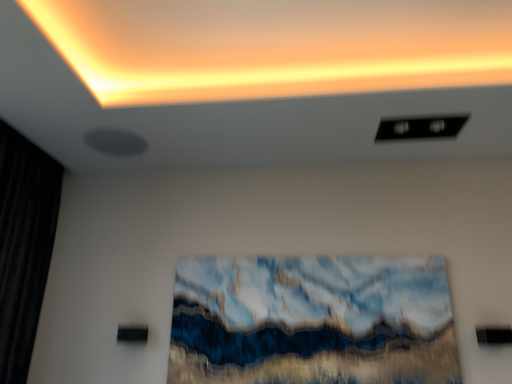
Question: Can you confirm if matte orange glow at upper center is shorter than black fabric curtain at left?

Choices:
 (A) yes
 (B) no

Answer: (A)

Question: From the image's perspective, is matte orange glow at upper center on top of black fabric curtain at left?

Choices:
 (A) no
 (B) yes

Answer: (B)

Question: From the image's perspective, is matte orange glow at upper center below black fabric curtain at left?

Choices:
 (A) no
 (B) yes

Answer: (A)

Question: Is matte orange glow at upper center further to camera compared to black fabric curtain at left?

Choices:
 (A) no
 (B) yes

Answer: (A)

Question: Is matte orange glow at upper center positioned in front of black fabric curtain at left?

Choices:
 (A) yes
 (B) no

Answer: (A)

Question: Does matte orange glow at upper center have a lesser width compared to black fabric curtain at left?

Choices:
 (A) no
 (B) yes

Answer: (A)

Question: Does textured blue and white abstract painting at center have a greater height compared to black fabric curtain at left?

Choices:
 (A) yes
 (B) no

Answer: (B)

Question: Is textured blue and white abstract painting at center wider than black fabric curtain at left?

Choices:
 (A) no
 (B) yes

Answer: (A)

Question: Is textured blue and white abstract painting at center oriented away from black fabric curtain at left?

Choices:
 (A) no
 (B) yes

Answer: (A)

Question: Can you confirm if textured blue and white abstract painting at center is positioned to the left of black fabric curtain at left?

Choices:
 (A) no
 (B) yes

Answer: (A)

Question: Is textured blue and white abstract painting at center at the right side of black fabric curtain at left?

Choices:
 (A) no
 (B) yes

Answer: (B)

Question: Are textured blue and white abstract painting at center and black fabric curtain at left located far from each other?

Choices:
 (A) yes
 (B) no

Answer: (A)

Question: Is black fabric curtain at left smaller than matte orange glow at upper center?

Choices:
 (A) yes
 (B) no

Answer: (B)